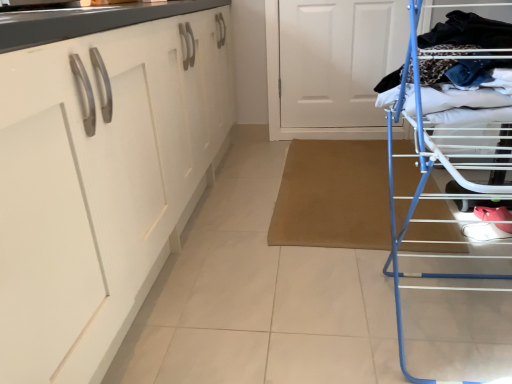
The height and width of the screenshot is (384, 512). What are the coordinates of `unoccupied area behind blue metal drying rack at right` in the screenshot? It's located at (336, 221).